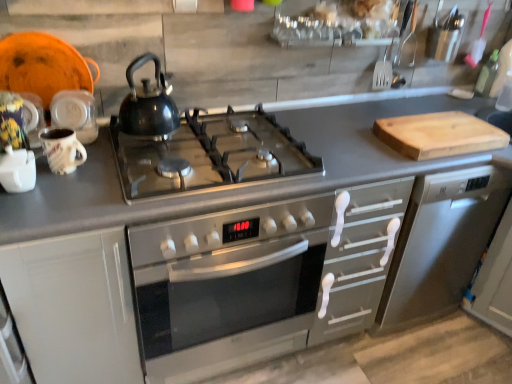
The width and height of the screenshot is (512, 384). In order to click on vacant area that is in front of matte ceramic mug at left in this screenshot , I will do `click(58, 205)`.